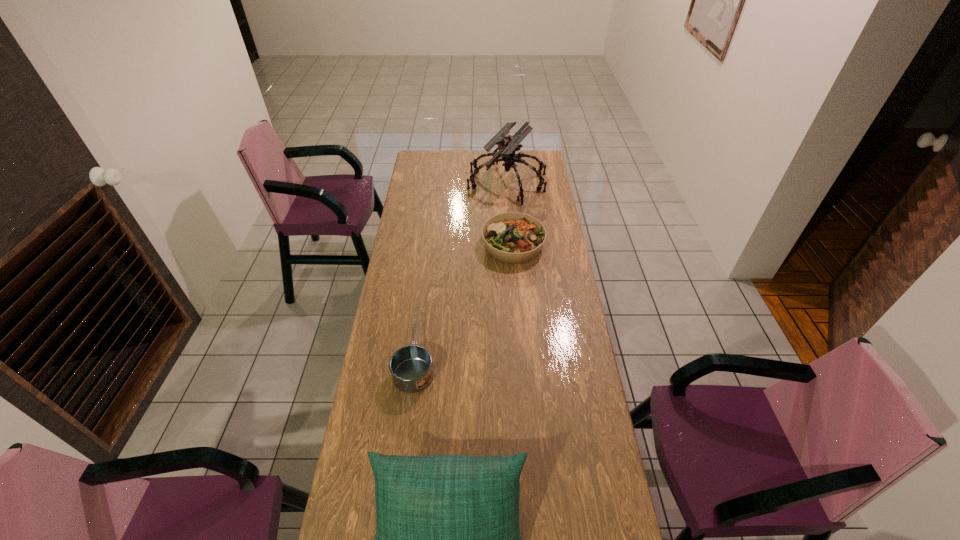
Identify the location of object that ranks as the second closest to the third farthest object. This screenshot has height=540, width=960. (511, 237).

Find the location of `free location that satisfies the following two spatial constraints: 1. with the handle extending from one side of the saucepan; 2. on the right side of the salad plate`. free location that satisfies the following two spatial constraints: 1. with the handle extending from one side of the saucepan; 2. on the right side of the salad plate is located at coordinates (429, 245).

Find the location of a particular element. The image size is (960, 540). free spot that satisfies the following two spatial constraints: 1. with the handle extending from one side of the third farthest object; 2. on the left side of the salad plate is located at coordinates (429, 245).

Identify the location of free space that satisfies the following two spatial constraints: 1. with the handle extending from one side of the second nearest object; 2. on the left side of the drone. Image resolution: width=960 pixels, height=540 pixels. (437, 181).

I want to click on free space that satisfies the following two spatial constraints: 1. with the handle extending from one side of the third farthest object; 2. on the right side of the farthest object, so click(437, 181).

Where is `vacant point that satisfies the following two spatial constraints: 1. with the handle extending from one side of the saucepan; 2. on the left side of the farthest object`? This screenshot has height=540, width=960. vacant point that satisfies the following two spatial constraints: 1. with the handle extending from one side of the saucepan; 2. on the left side of the farthest object is located at coordinates (437, 181).

What are the coordinates of `vacant space that satisfies the following two spatial constraints: 1. with the handle extending from one side of the farthest object; 2. on the right side of the third farthest object` in the screenshot? It's located at (437, 181).

You are a GUI agent. You are given a task and a screenshot of the screen. Output one action in this format:
    pyautogui.click(x=<x>, y=<y>)
    Task: Click on the vacant space that satisfies the following two spatial constraints: 1. with the handle extending from one side of the third farthest object; 2. on the left side of the third nearest object
    This screenshot has width=960, height=540.
    Given the screenshot: What is the action you would take?
    (x=429, y=245)